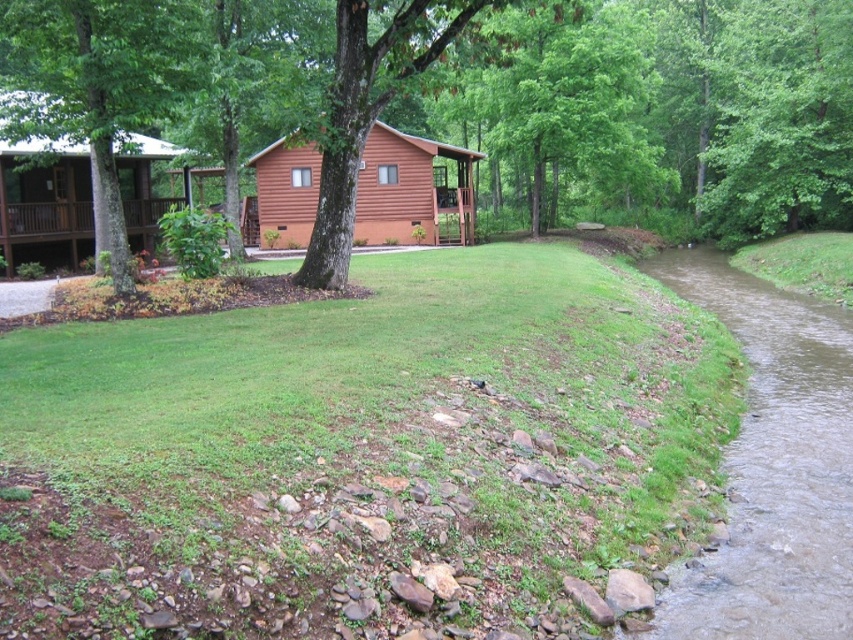
Question: Can you confirm if brown muddy water at lower right is bigger than brown log cabin at center?

Choices:
 (A) no
 (B) yes

Answer: (A)

Question: Is green leafy tree at center positioned before brown log cabin at center?

Choices:
 (A) no
 (B) yes

Answer: (B)

Question: Which of these objects is positioned closest to the brown wooden cabin at upper left?

Choices:
 (A) brown log cabin at center
 (B) green leafy tree at center
 (C) brown muddy water at lower right

Answer: (A)

Question: Which of these objects is positioned farthest from the brown wooden cabin at upper left?

Choices:
 (A) brown log cabin at center
 (B) green leafy tree at center
 (C) brown muddy water at lower right

Answer: (C)

Question: Does green leafy tree at center come behind brown wooden cabin at upper left?

Choices:
 (A) no
 (B) yes

Answer: (A)

Question: Which point appears farthest from the camera in this image?

Choices:
 (A) (811, 627)
 (B) (135, 234)
 (C) (396, 138)

Answer: (C)